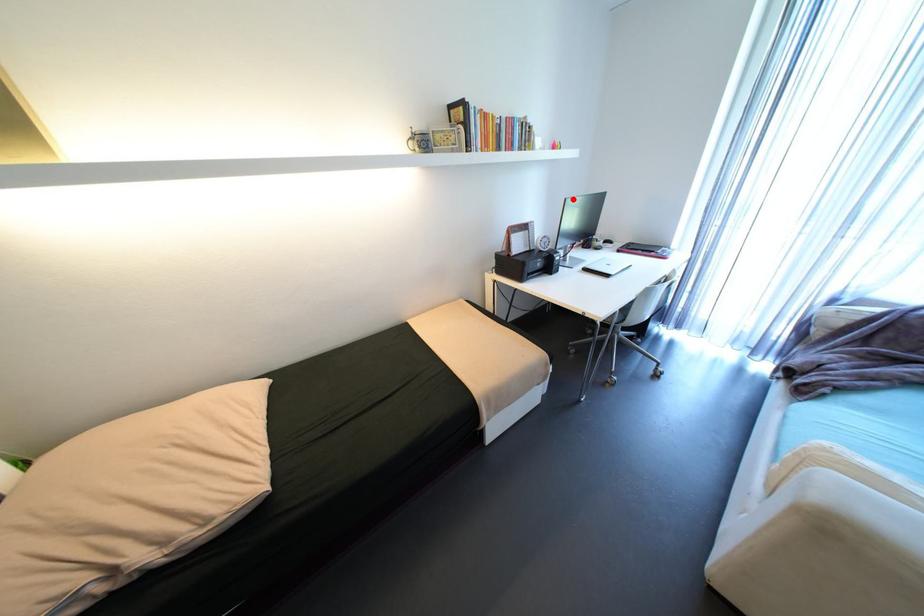
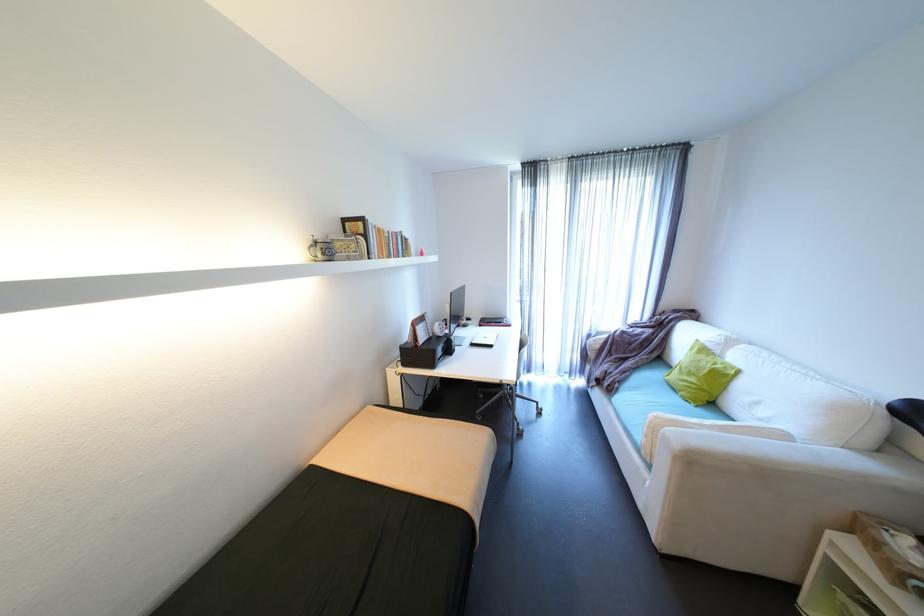
Question: I am providing you with two images of the same scene from different viewpoints. Given a red point in image1, look at the same physical point in image2. Is it:

Choices:
 (A) Closer to the viewpoint
 (B) Farther from the viewpoint

Answer: (B)